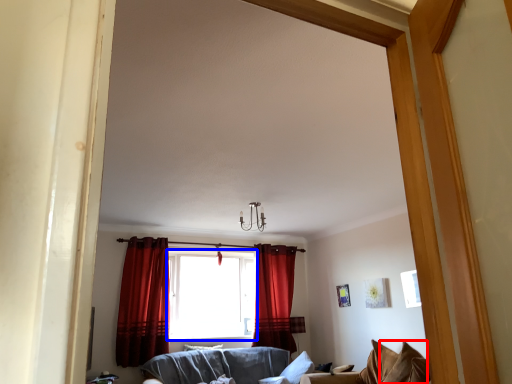
Question: Which point is closer to the camera, pillow (highlighted by a red box) or window (highlighted by a blue box)?

Choices:
 (A) pillow
 (B) window

Answer: (A)